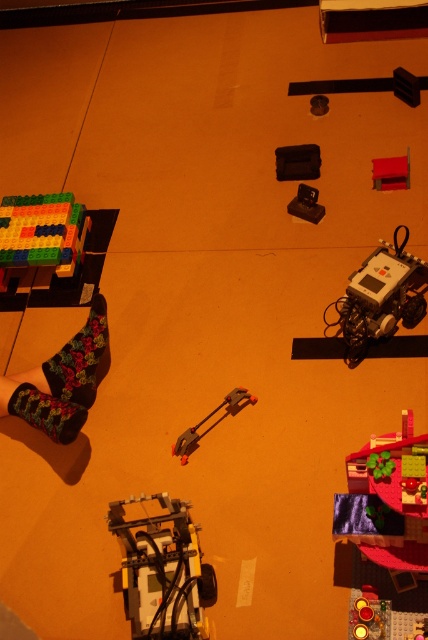
Question: Which point is farther to the camera?

Choices:
 (A) metallic red clamp at center
 (B) black floral socks at lower left
 (C) velvet floral socks at lower left

Answer: (A)

Question: Estimate the real-world distances between objects in this image. Which object is farther from the velvet green cushion at lower right?

Choices:
 (A) black plastic toy at center
 (B) matte black case at center
 (C) shiny metallic gear at center
 (D) metallic red clamp at center

Answer: (B)

Question: In this image, where is translucent plastic motor at center located relative to rubberized red toy at upper right?

Choices:
 (A) right
 (B) left

Answer: (B)

Question: Can you confirm if black floral socks at lower left is positioned to the left of shiny metallic gear at center?

Choices:
 (A) yes
 (B) no

Answer: (A)

Question: Which point is closer to the camera?

Choices:
 (A) velvet floral socks at lower left
 (B) metallic red clamp at center

Answer: (A)

Question: Is translucent plastic motor at center below black floral socks at lower left?

Choices:
 (A) yes
 (B) no

Answer: (A)